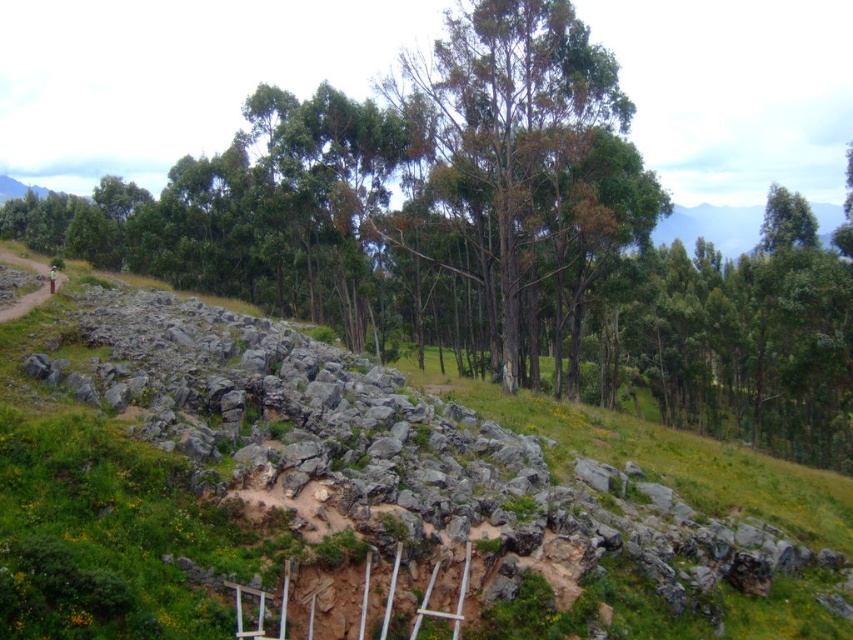
Which is more to the right, gray rock wall at center or green leafy tree at center?

From the viewer's perspective, gray rock wall at center appears more on the right side.

Who is lower down, gray rock wall at center or green leafy tree at center?

Positioned lower is gray rock wall at center.

Find the location of `gray rock wall at center`. gray rock wall at center is located at coordinates (341, 497).

Does point (424, 531) lie behind point (456, 68)?

No, (424, 531) is in front of (456, 68).

Can you confirm if gray rock wall at center is shorter than green leafy trees at center?

Yes, gray rock wall at center is shorter than green leafy trees at center.

Who is more forward, (351,508) or (527,92)?

Point (351,508) is more forward.

Find the location of a particular element. Image resolution: width=853 pixels, height=640 pixels. gray rock wall at center is located at coordinates (341, 497).

Which of these two, green leafy tree at center or green leafy trees at center, stands taller?

With more height is green leafy tree at center.

Does green leafy tree at center appear over green leafy trees at center?

Yes.

Identify the location of green leafy tree at center. The width and height of the screenshot is (853, 640). (495, 234).

Find the location of `green leafy tree at center`. green leafy tree at center is located at coordinates (495, 234).